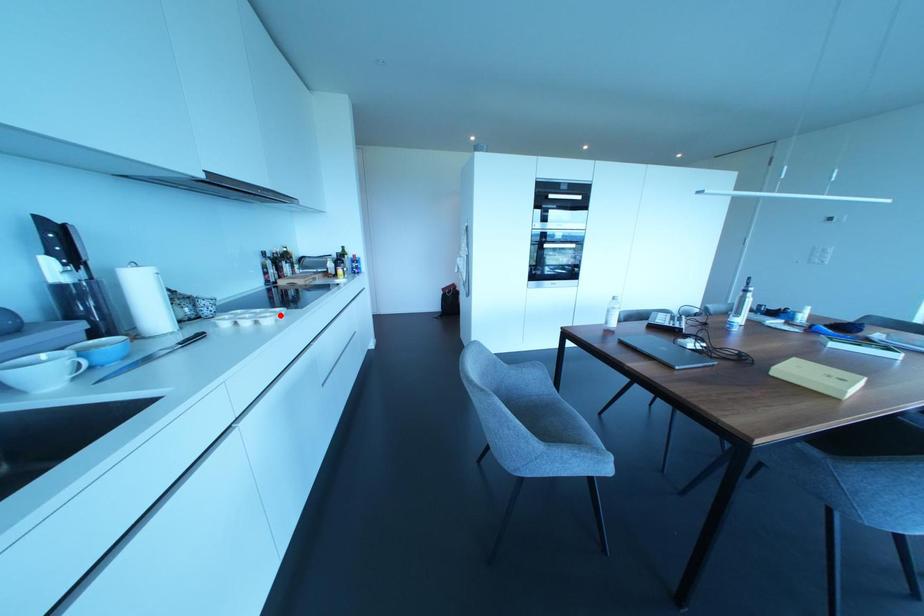
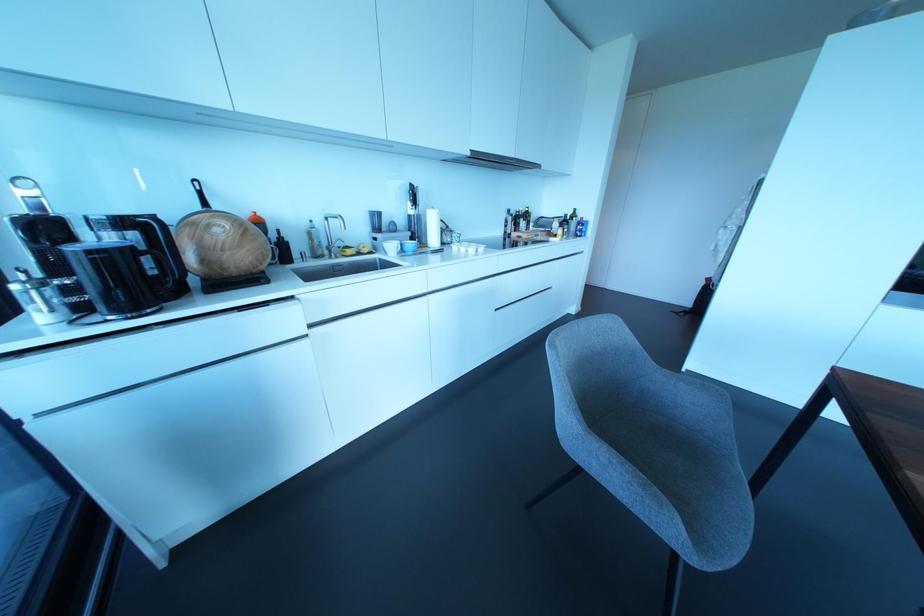
Where in the second image is the point corresponding to the highlighted location from the first image?

(480, 249)